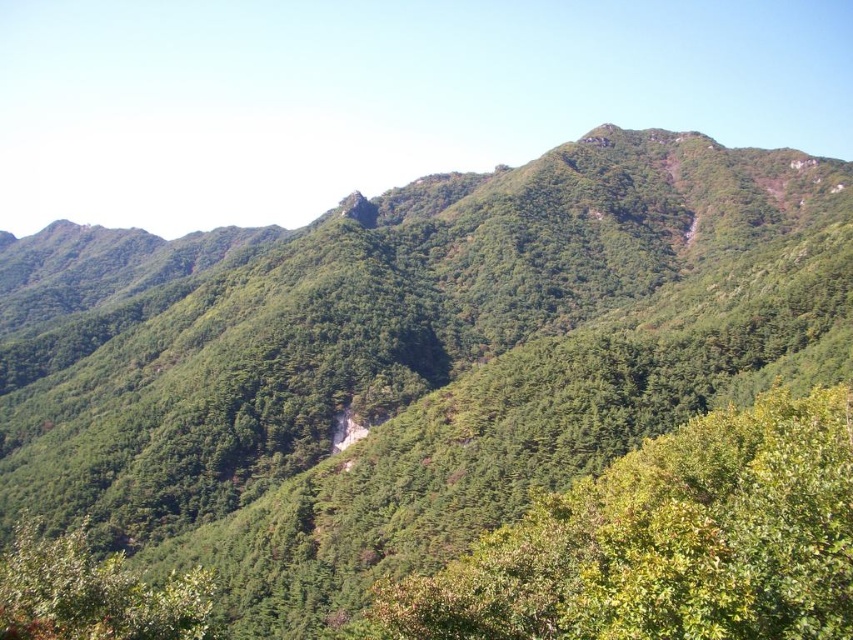
Question: Among these points, which one is farthest from the camera?

Choices:
 (A) (119, 602)
 (B) (674, 570)

Answer: (A)

Question: Which of the following is the closest to the observer?

Choices:
 (A) green leafy tree at center
 (B) green matte tree at lower left

Answer: (A)

Question: Observing the image, what is the correct spatial positioning of green leafy tree at center in reference to green matte tree at lower left?

Choices:
 (A) below
 (B) above

Answer: (B)

Question: Does green leafy tree at center have a lesser width compared to green matte tree at lower left?

Choices:
 (A) yes
 (B) no

Answer: (A)

Question: Does green leafy tree at center lie behind green matte tree at lower left?

Choices:
 (A) yes
 (B) no

Answer: (B)

Question: Which point appears farthest from the camera in this image?

Choices:
 (A) (91, 572)
 (B) (408, 605)

Answer: (A)